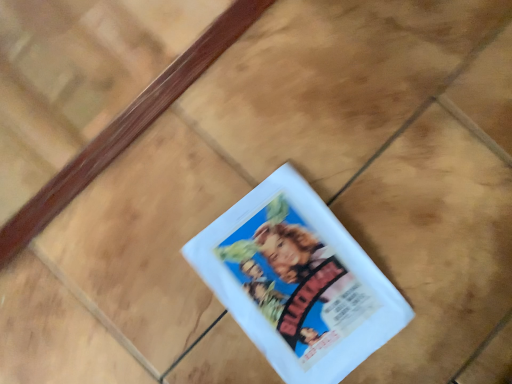
Locate an element on the screen. Image resolution: width=512 pixels, height=384 pixels. empty space that is ontop of white paper at center (from a real-world perspective) is located at coordinates (298, 286).